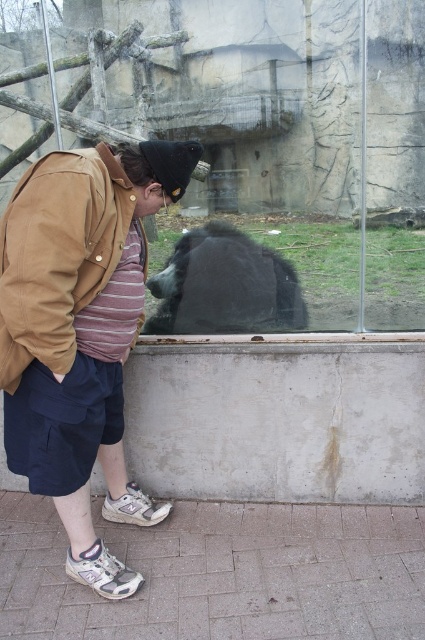
Can you confirm if brown cotton jacket at center is positioned to the right of black fur bear at center?

No, brown cotton jacket at center is not to the right of black fur bear at center.

Is brown cotton jacket at center behind black fur bear at center?

That is False.

What do you see at coordinates (81, 332) in the screenshot?
I see `brown cotton jacket at center` at bounding box center [81, 332].

Locate an element on the screen. This screenshot has width=425, height=640. brown cotton jacket at center is located at coordinates point(81,332).